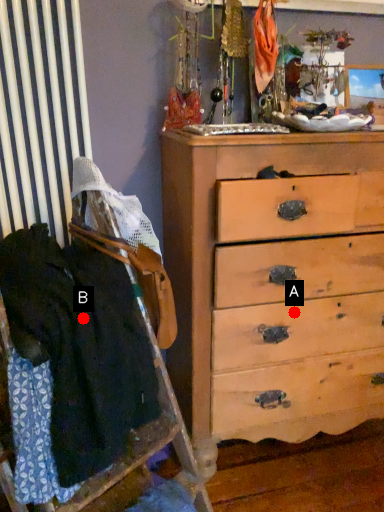
Question: Two points are circled on the image, labeled by A and B beside each circle. Among these points, which one is nearest to the camera?

Choices:
 (A) A is closer
 (B) B is closer

Answer: (B)